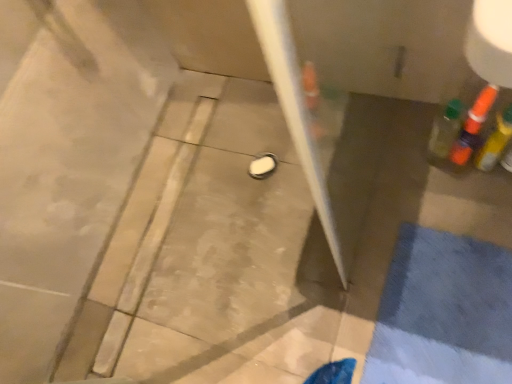
At what (x,y) coordinates should I click in order to perform the action: click on free space behind translucent plastic bottle at right, the third bottle positioned from the right. Please return your answer as a coordinate pair (x, y). Looking at the image, I should click on (398, 124).